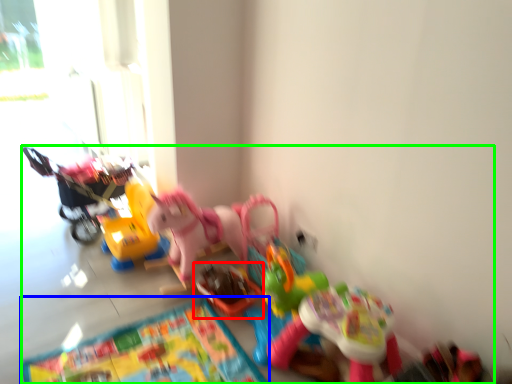
Question: Considering the real-world distances, which object is closest to toy (highlighted by a red box)? mat (highlighted by a blue box) or toy (highlighted by a green box).

Choices:
 (A) mat
 (B) toy

Answer: (A)